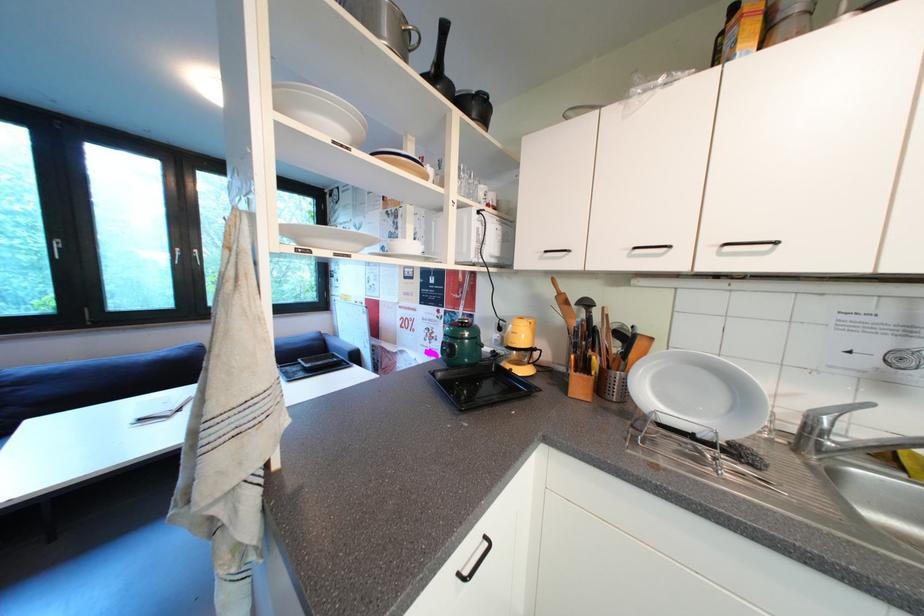
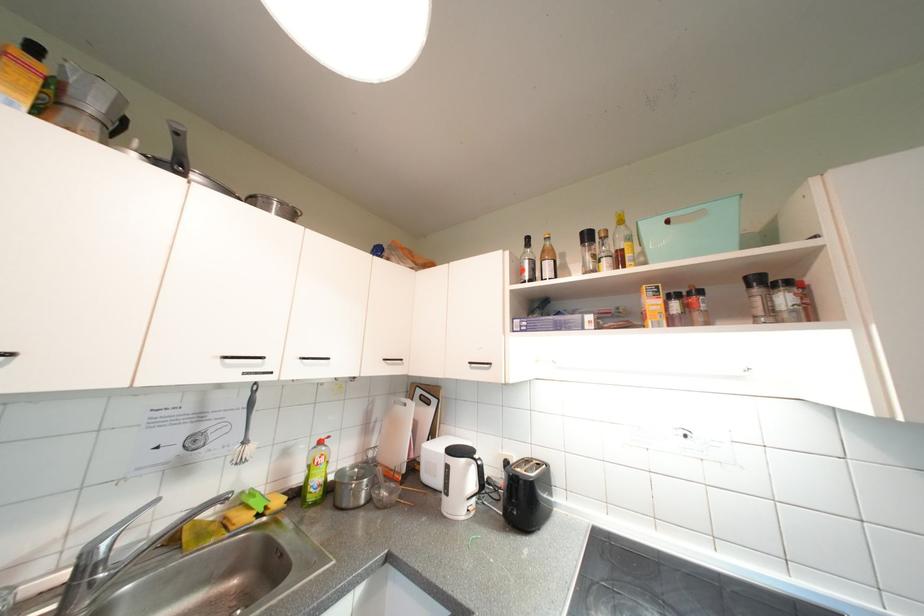
Question: The camera is either moving clockwise (left) or counter-clockwise (right) around the object. The first image is from the beginning of the video and the second image is from the end. Is the camera moving left or right when shooting the video?

Choices:
 (A) Left
 (B) Right

Answer: (A)